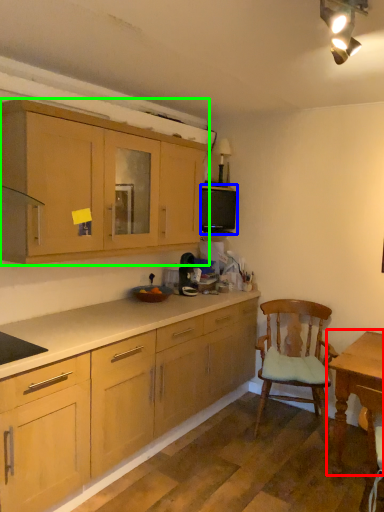
Question: Estimate the real-world distances between objects in this image. Which object is closer to table (highlighted by a red box), appliance (highlighted by a blue box) or cabinetry (highlighted by a green box)?

Choices:
 (A) appliance
 (B) cabinetry

Answer: (A)